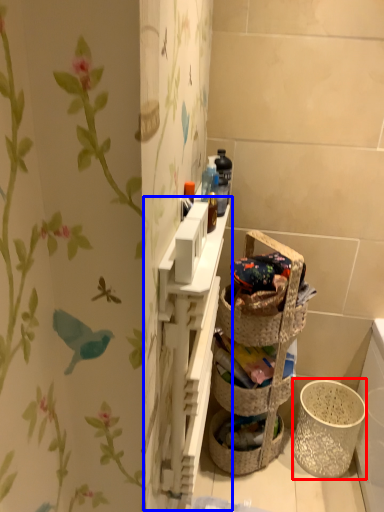
Question: Which point is closer to the camera, basket container (highlighted by a red box) or cabinet (highlighted by a blue box)?

Choices:
 (A) basket container
 (B) cabinet

Answer: (B)